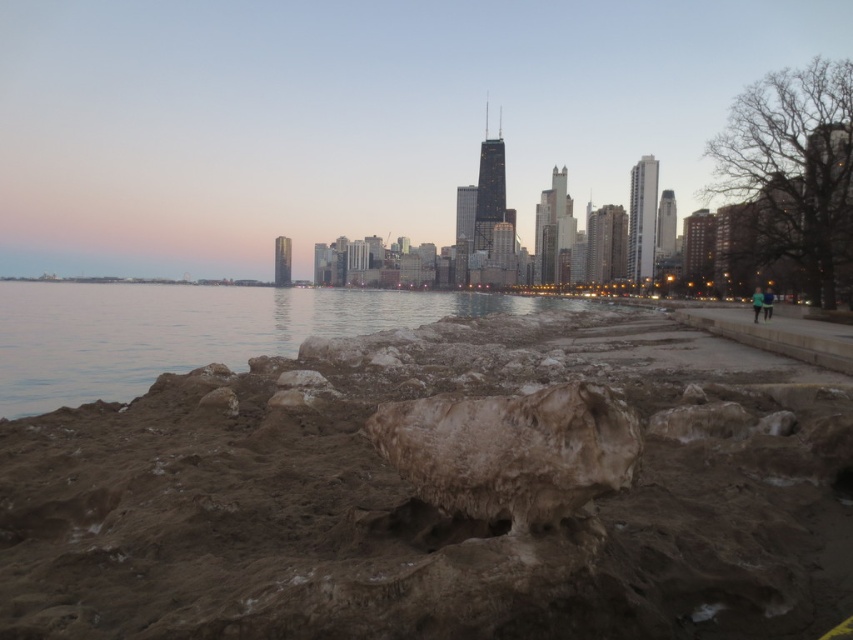
You are standing at the edge of the rocky shoreline in the scene. There is a point marked at coordinates (x=433, y=499). What type of surface is this point located on?

The point at (x=433, y=499) is on a brown muddy rock at lower center.

Based on the photo, you are standing at the rocky shoreline and want to walk to the point marked as point (x=694, y=486) and point (x=433, y=458). Which point is closer to you?

Point (x=433, y=458) is closer to you because it is less further to the viewer than point (x=694, y=486).

You are standing on the rocky shoreline and want to place a small potted plant between the brown muddy rock at lower center and the brown rough stone at center. Based on their positions, where should you position the potted plant to ensure it is between them?

The brown muddy rock at lower center is located below the brown rough stone at center, so you should place the potted plant between them by positioning it above the brown muddy rock at lower center and below the brown rough stone at center.